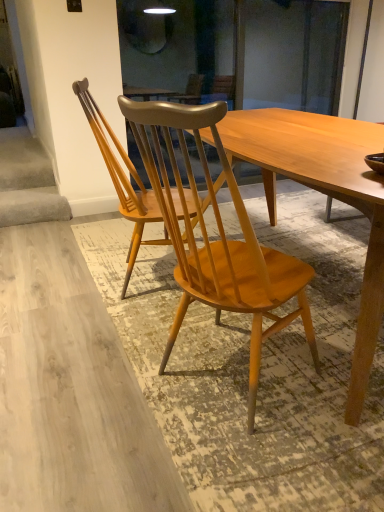
I want to click on vacant area in front of light brown wood chair at center, positioned as the 1th chair in back-to-front order, so click(154, 325).